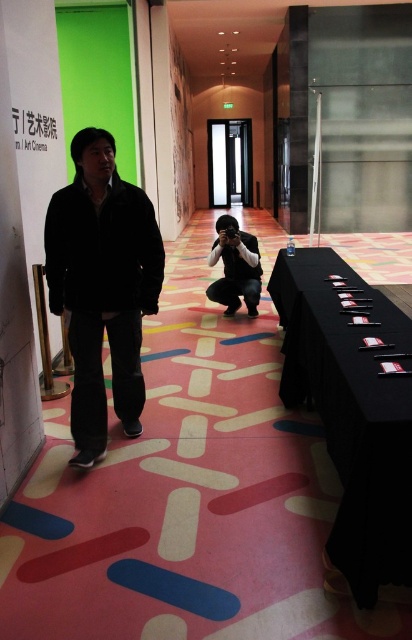
You are a visitor at the Art Cinema and want to place your jacket on the black fabric table at lower right. Based on the height of the dark matte jacket at center, will it fit comfortably on the table?

The black fabric table at lower right has a lesser height compared to the dark matte jacket at center, so the jacket may not fit comfortably on the table as the table is shorter than the jacket.